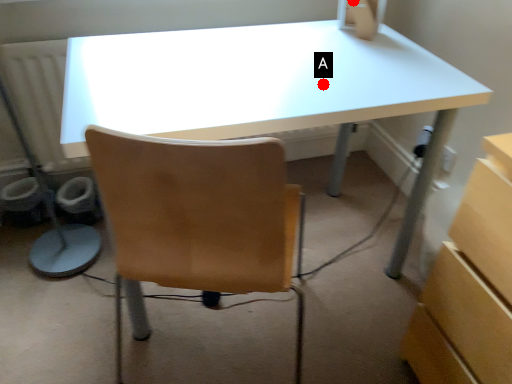
Question: Two points are circled on the image, labeled by A and B beside each circle. Among these points, which one is farthest from the camera?

Choices:
 (A) A is further
 (B) B is further

Answer: (B)